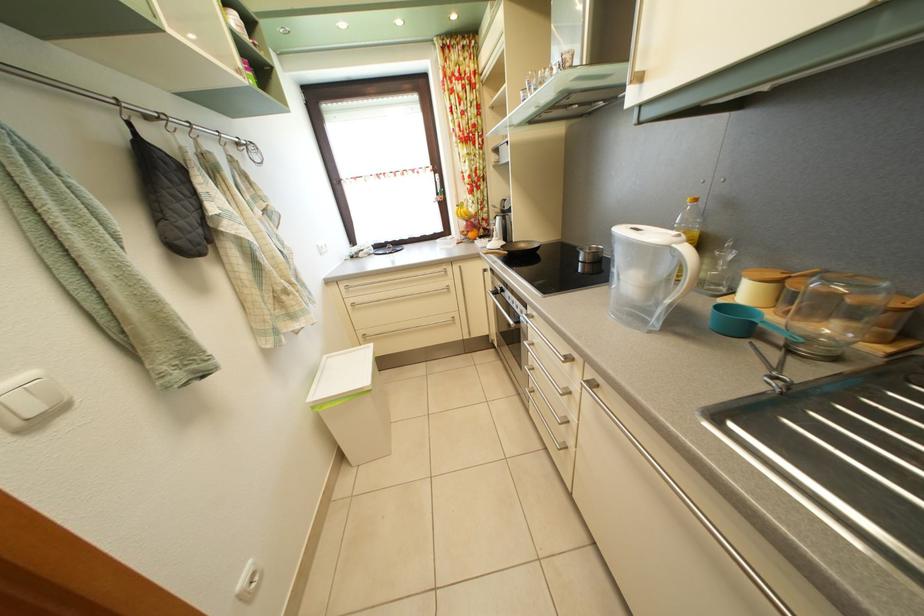
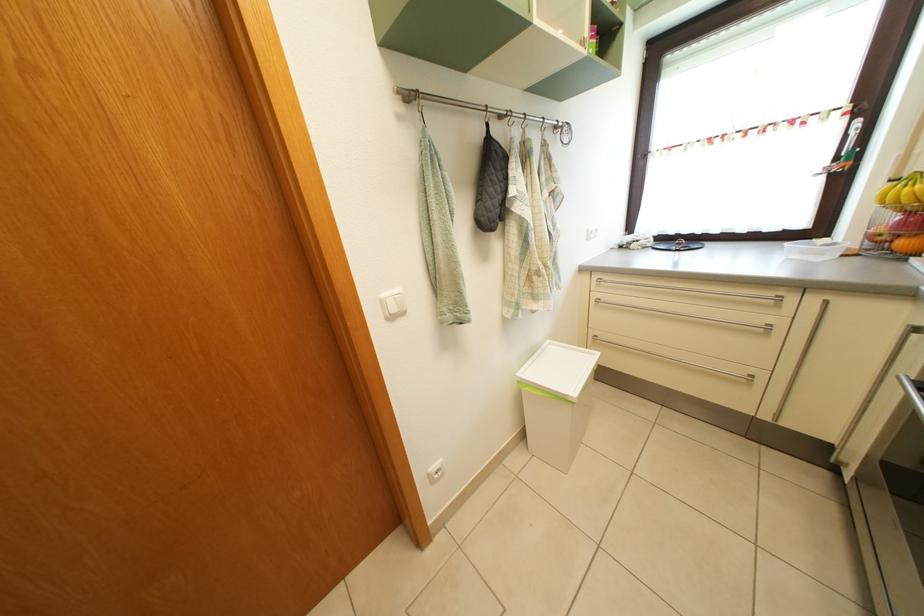
Find the pixel in the second image that matches the point at 448,277 in the first image.

(776, 302)